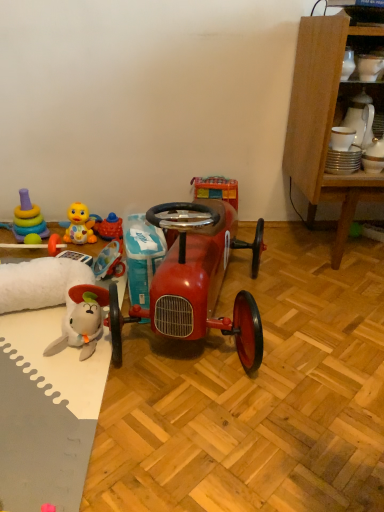
Question: In terms of height, does rubber duck at left, acting as the 2th toy starting from the right, look taller or shorter compared to wooden cabinet at right?

Choices:
 (A) short
 (B) tall

Answer: (A)

Question: Is rubber duck at left, which is the 4th toy from left to right, wider or thinner than wooden cabinet at right?

Choices:
 (A) thin
 (B) wide

Answer: (A)

Question: Which object is the closest to the rubber duck at lower left, the second toy in the left-to-right sequence?

Choices:
 (A) wooden cabinet at right
 (B) glossy red model car at center
 (C) yellow rubber duck at left, which is counted as the third toy, starting from the right
 (D) rubber duck at left, acting as the 2th toy starting from the right
 (E) white glossy mug at upper center, which is counted as the 1th toy, starting from the right

Answer: (C)

Question: Which object is positioned farthest from the rubber duck at lower left, the second toy in the left-to-right sequence?

Choices:
 (A) stacked plastic rings at left, which ranks as the 5th toy in right-to-left order
 (B) rubber duck at left, acting as the 2th toy starting from the right
 (C) wooden cabinet at right
 (D) white glossy mug at upper center, which is counted as the 1th toy, starting from the right
 (E) yellow rubber duck at left, which is counted as the third toy, starting from the right

Answer: (D)